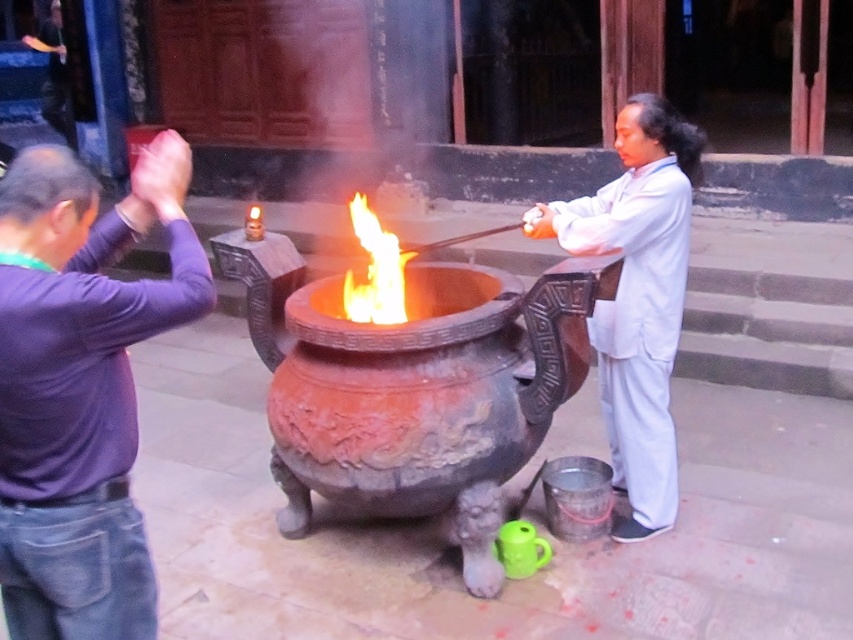
In the scene shown: Does purple cotton shirt at upper left appear under flamematerial/texture at center?

Yes, purple cotton shirt at upper left is below flamematerial/texture at center.

Which is more to the left, purple cotton shirt at upper left or flamematerial/texture at center?

purple cotton shirt at upper left is more to the left.

The image size is (853, 640). In order to click on purple cotton shirt at upper left in this screenshot , I will do `click(82, 381)`.

Can you confirm if white matte robe at center is smaller than flamematerial/texture at center?

No, white matte robe at center is not smaller than flamematerial/texture at center.

Who is taller, white matte robe at center or flamematerial/texture at center?

white matte robe at center is taller.

Does point (653, 342) come in front of point (398, 285)?

Yes, it is.

You are a GUI agent. You are given a task and a screenshot of the screen. Output one action in this format:
    pyautogui.click(x=<x>, y=<y>)
    Task: Click on the white matte robe at center
    
    Given the screenshot: What is the action you would take?
    pyautogui.click(x=637, y=321)

Looking at this image, does purple cotton shirt at upper left appear on the left side of white matte robe at center?

Correct, you'll find purple cotton shirt at upper left to the left of white matte robe at center.

Is purple cotton shirt at upper left thinner than white matte robe at center?

In fact, purple cotton shirt at upper left might be wider than white matte robe at center.

The width and height of the screenshot is (853, 640). In order to click on purple cotton shirt at upper left in this screenshot , I will do 82,381.

Locate an element on the screen. The image size is (853, 640). purple cotton shirt at upper left is located at coordinates point(82,381).